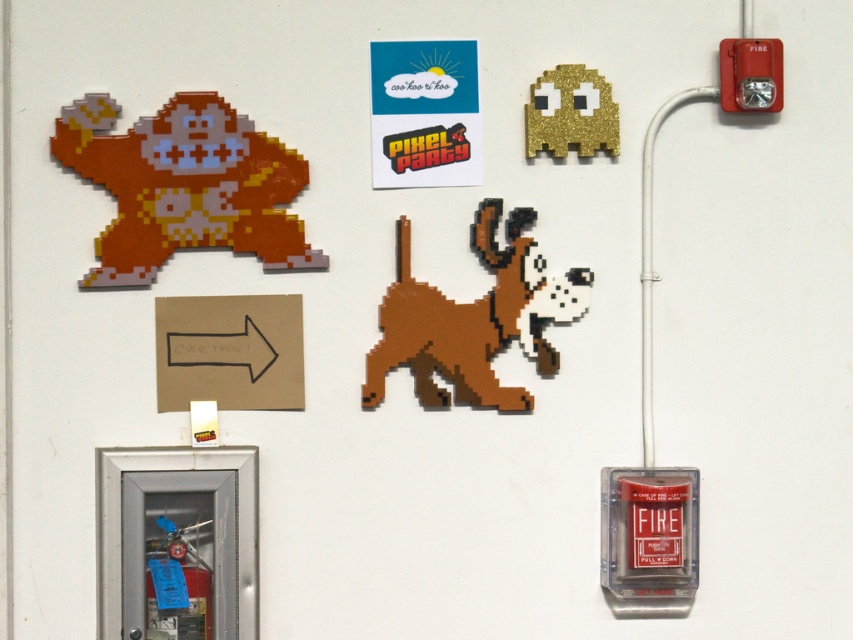
Question: Which is farther from the gold glitter ghost at upper center?

Choices:
 (A) matte orange pixelated monkey at upper left
 (B) brown matte reindeer at center

Answer: (A)

Question: Can you confirm if matte orange pixelated monkey at upper left is thinner than brown matte reindeer at center?

Choices:
 (A) no
 (B) yes

Answer: (A)

Question: Which of these objects is positioned farthest from the matte orange pixelated monkey at upper left?

Choices:
 (A) brown matte reindeer at center
 (B) gold glitter ghost at upper center

Answer: (B)

Question: Which point is closer to the camera?

Choices:
 (A) matte orange pixelated monkey at upper left
 (B) gold glitter ghost at upper center
 (C) brown matte reindeer at center

Answer: (A)

Question: Does matte orange pixelated monkey at upper left have a larger size compared to brown matte reindeer at center?

Choices:
 (A) yes
 (B) no

Answer: (A)

Question: Does matte orange pixelated monkey at upper left appear on the right side of gold glitter ghost at upper center?

Choices:
 (A) yes
 (B) no

Answer: (B)